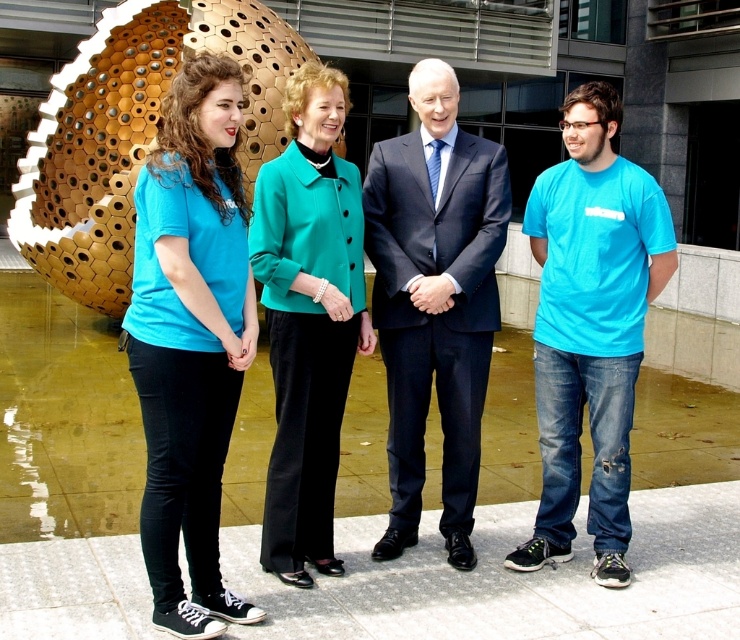
Question: Can you confirm if dark blue suit at center is smaller than turquoise t-shirt at right?

Choices:
 (A) no
 (B) yes

Answer: (B)

Question: Which point is farther to the camera?

Choices:
 (A) turquoise t-shirt at right
 (B) teal fabric jacket at center
 (C) matte blue shirt at left
 (D) dark blue suit at center

Answer: (D)

Question: Is matte blue shirt at left smaller than turquoise t-shirt at right?

Choices:
 (A) no
 (B) yes

Answer: (B)

Question: Observing the image, what is the correct spatial positioning of matte blue shirt at left in reference to dark blue suit at center?

Choices:
 (A) above
 (B) below

Answer: (B)

Question: Which object is positioned closest to the dark blue suit at center?

Choices:
 (A) turquoise t-shirt at right
 (B) teal fabric jacket at center

Answer: (B)

Question: Estimate the real-world distances between objects in this image. Which object is closer to the matte blue shirt at left?

Choices:
 (A) teal fabric jacket at center
 (B) turquoise t-shirt at right
 (C) dark blue suit at center

Answer: (A)